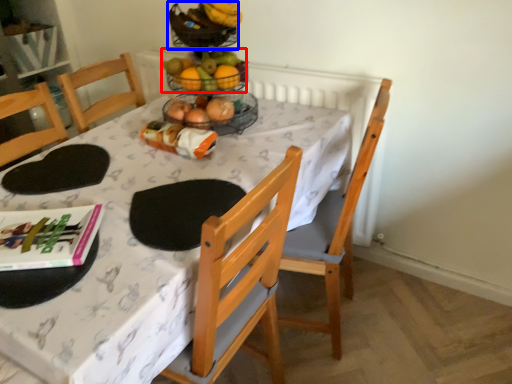
Question: Which point is further to the camera, grapefruit (highlighted by a red box) or basket (highlighted by a blue box)?

Choices:
 (A) grapefruit
 (B) basket

Answer: (A)